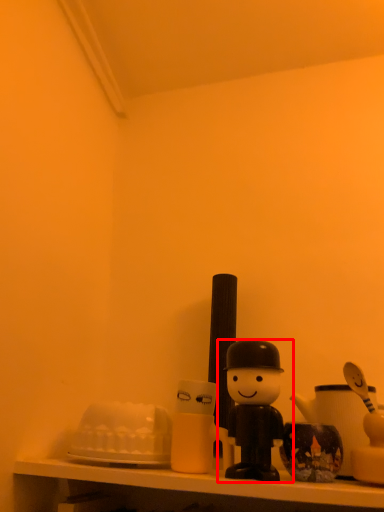
Question: In this image, where is toy (annotated by the red box) located relative to shelf?

Choices:
 (A) left
 (B) right

Answer: (B)